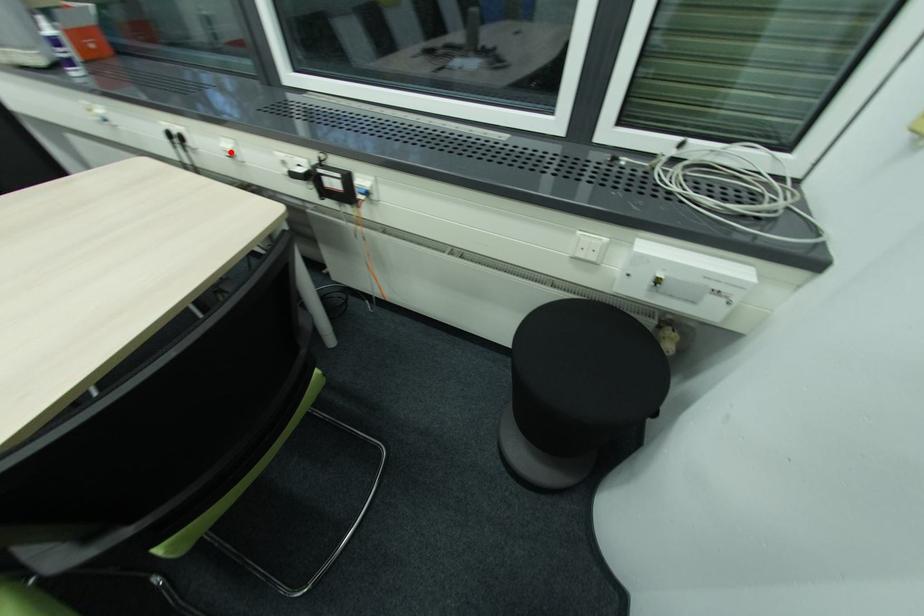
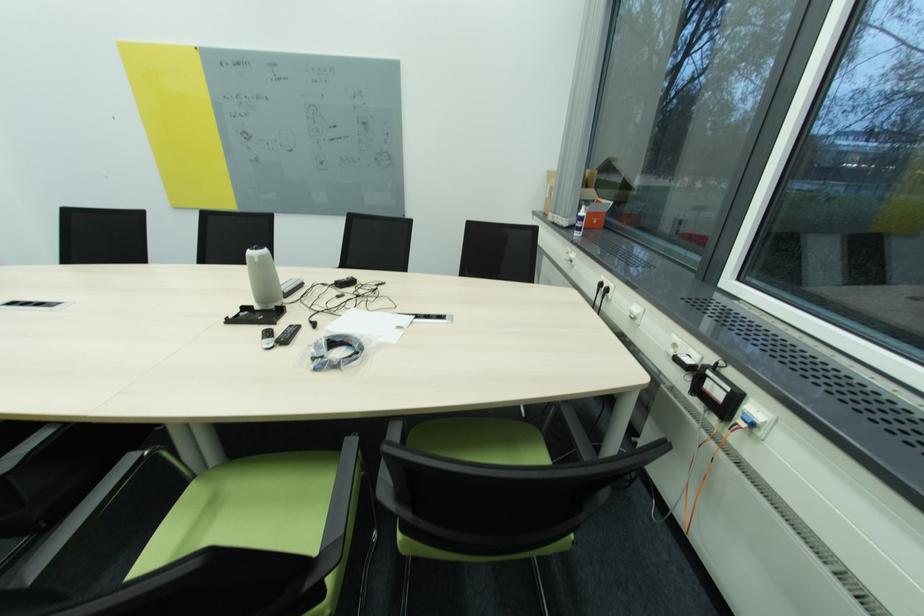
Question: I am providing you with two images of the same scene from different viewpoints. In image1, a red point is highlighted. Considering the same 3D point in image2, which of the following is correct?

Choices:
 (A) It is closer
 (B) It is farther

Answer: (A)